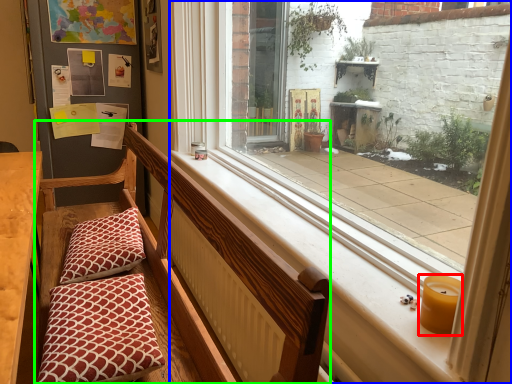
Question: Which object is positioned farthest from candle holder (highlighted by a red box)? Select from window (highlighted by a blue box) and church bench (highlighted by a green box).

Choices:
 (A) window
 (B) church bench

Answer: (B)